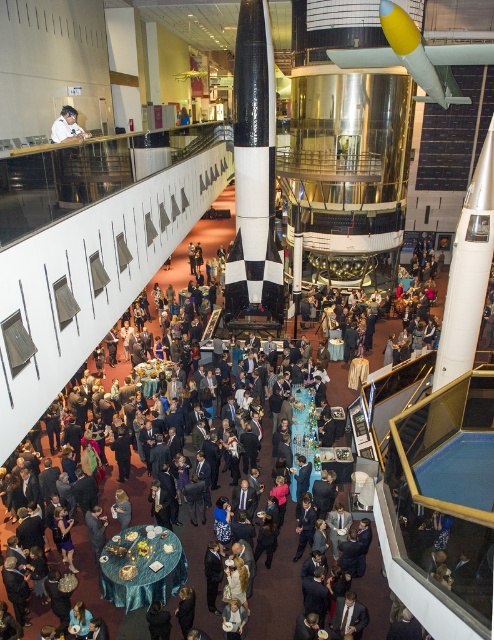
Question: Does white glossy rocket at center appear on the left side of matte white missile at center?

Choices:
 (A) no
 (B) yes

Answer: (B)

Question: Based on their relative distances, which object is farther from the white glossy rocket at center?

Choices:
 (A) black-and-white checkered missile at center
 (B) matte white missile at center

Answer: (A)

Question: Does white glossy rocket at center appear on the left side of matte white missile at center?

Choices:
 (A) yes
 (B) no

Answer: (A)

Question: Is black-and-white checkered missile at center to the left of blue satin table at center from the viewer's perspective?

Choices:
 (A) yes
 (B) no

Answer: (B)

Question: Which point is farther from the camera taking this photo?

Choices:
 (A) (51, 131)
 (B) (456, 358)
 (C) (374, 58)

Answer: (A)

Question: Which point appears closest to the camera in this image?

Choices:
 (A) [236, 310]
 (B) [459, 310]
 (C) [72, 120]

Answer: (B)